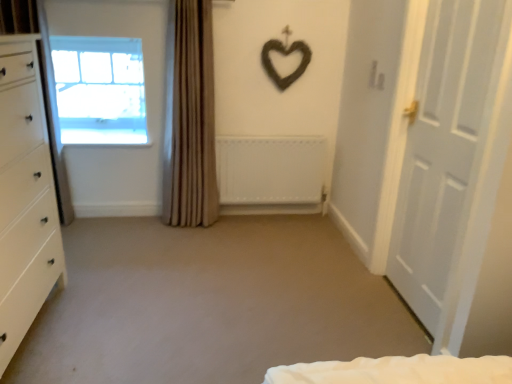
Where is `vacant space that's between white matte door at right and white glossy chest of drawers at left`? The height and width of the screenshot is (384, 512). vacant space that's between white matte door at right and white glossy chest of drawers at left is located at coordinates (224, 314).